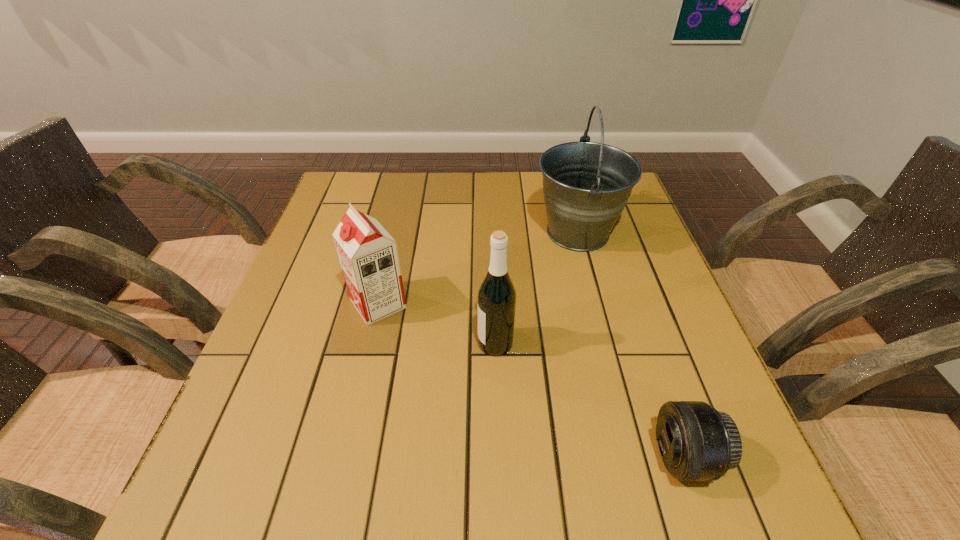
You are a GUI agent. You are given a task and a screenshot of the screen. Output one action in this format:
    pyautogui.click(x=<x>, y=<y>)
    Task: Click on the vacant space located 0.090m on the label of the wine bottle
    
    Given the screenshot: What is the action you would take?
    pyautogui.click(x=434, y=343)

Image resolution: width=960 pixels, height=540 pixels. Find the location of `vacant space located on the label of the wine bottle`. vacant space located on the label of the wine bottle is located at coordinates (356, 343).

Image resolution: width=960 pixels, height=540 pixels. In order to click on vacant space located 0.260m on the front of the soya milk in this screenshot , I will do `click(347, 442)`.

Locate an element on the screen. vacant space located on the front-facing side of the telephoto lens is located at coordinates (486, 457).

Where is `vacant space located 0.320m on the front-facing side of the telephoto lens`? The height and width of the screenshot is (540, 960). vacant space located 0.320m on the front-facing side of the telephoto lens is located at coordinates (462, 457).

Image resolution: width=960 pixels, height=540 pixels. I want to click on vacant space located 0.120m on the front-facing side of the telephoto lens, so click(583, 457).

I want to click on object located at the far edge, so 586,185.

Locate an element on the screen. object present at the near edge is located at coordinates (697, 443).

The width and height of the screenshot is (960, 540). What are the coordinates of `object situated at the left edge` in the screenshot? It's located at (368, 255).

The height and width of the screenshot is (540, 960). I want to click on bucket located in the right edge section of the desktop, so click(x=586, y=185).